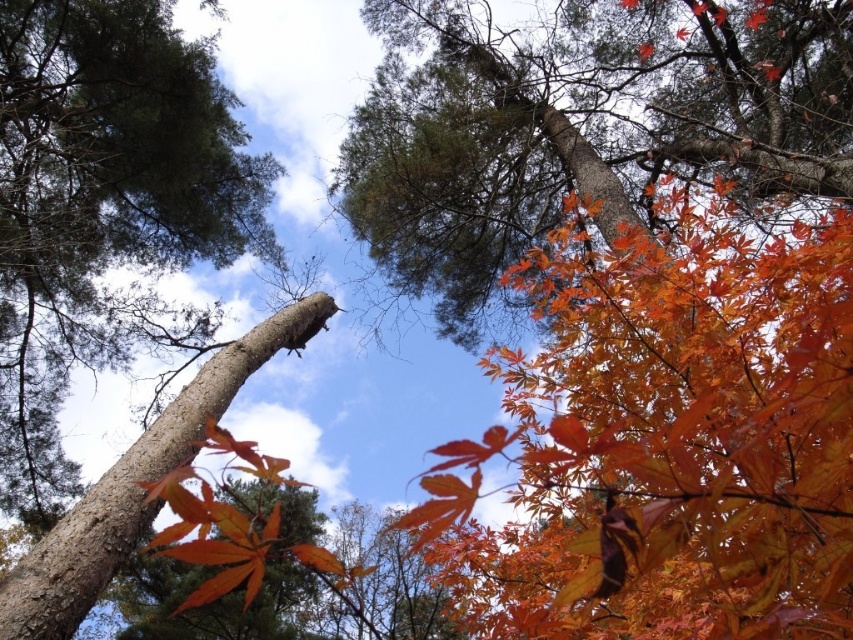
You are standing in the forest and want to reach out and touch the shiny orange leaves at upper right. Your arm can extend 1.8 meters. Can you reach them?

The shiny orange leaves at upper right are 2.11 meters away from the viewer, which is beyond the 1.8 meters your arm can extend. Therefore, you cannot reach them.

You are standing in the forest looking up at the autumn leaves. There are two points marked in the image, one at coordinates point (97, 484) and the other at point (224, 508). Which point is nearer to you?

Point (97, 484) is closer to the viewer than point (224, 508).

You are a bird flying through the forest and want to land on the orange matte leaves at upper center. Based on the coordinates provided, can you estimate the direction you should fly to reach them?

The orange matte leaves at upper center are located at coordinates point (581, 125). Since the x and y values are both less than 0.5, the leaves are positioned slightly to the left and lower half of the image. To reach them, you should fly towards the left and downward direction from your current position.